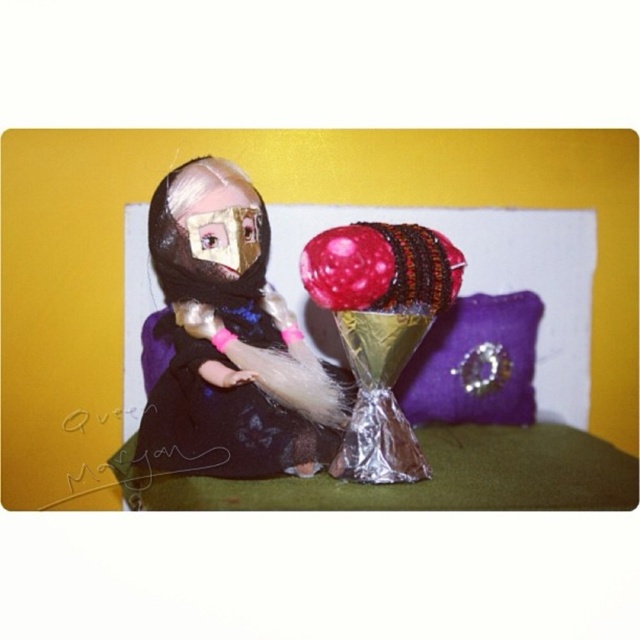
Who is more forward, [243,378] or [440,396]?

Point [243,378]

Locate an element on the screen. The width and height of the screenshot is (640, 640). velvet black dress at center is located at coordinates (228, 408).

Find the location of `velvet black dress at center`. velvet black dress at center is located at coordinates (228, 408).

Is purple velvet pillow at center to the right of glossy plastic balloon at center from the viewer's perspective?

Yes, purple velvet pillow at center is to the right of glossy plastic balloon at center.

Does point (483, 394) come closer to viewer compared to point (355, 280)?

No, it is not.

Does point (413, 371) come closer to viewer compared to point (349, 243)?

No, (413, 371) is further to viewer.

You are a GUI agent. You are given a task and a screenshot of the screen. Output one action in this format:
    pyautogui.click(x=<x>, y=<y>)
    Task: Click on the purple velvet pillow at center
    The width and height of the screenshot is (640, 640).
    Given the screenshot: What is the action you would take?
    pyautogui.click(x=476, y=364)

Is purple fabric bed at center to the left of velvet black dress at center from the viewer's perspective?

Incorrect, purple fabric bed at center is not on the left side of velvet black dress at center.

From the picture: Who is more forward, (435, 468) or (161, 465)?

Point (161, 465) is more forward.

Where is `purple fabric bed at center`? The width and height of the screenshot is (640, 640). purple fabric bed at center is located at coordinates (433, 426).